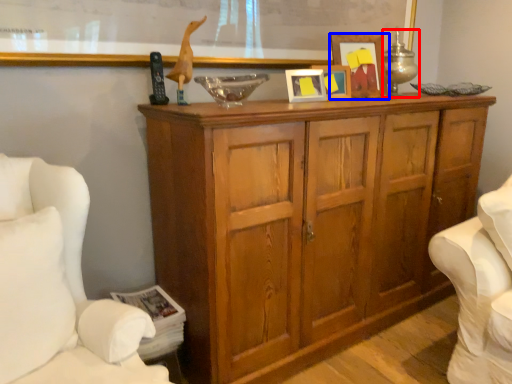
Question: Among these objects, which one is farthest to the camera, table lamp (highlighted by a red box) or picture frame (highlighted by a blue box)?

Choices:
 (A) table lamp
 (B) picture frame

Answer: (A)